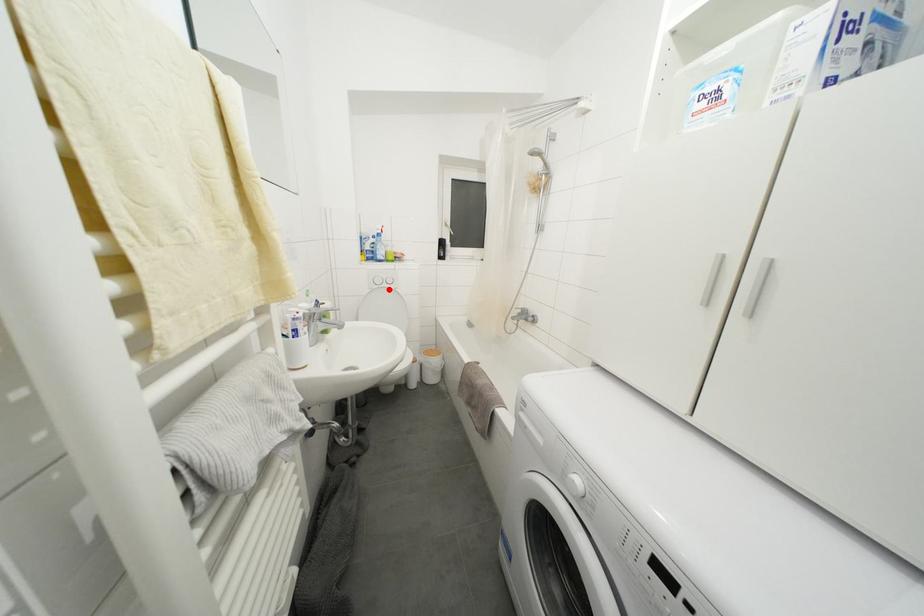
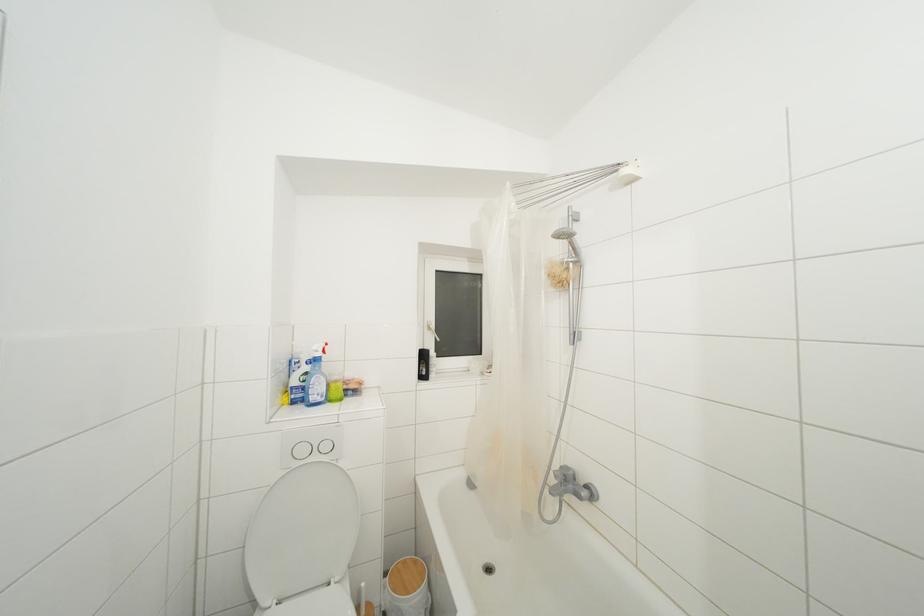
The point at the highlighted location is marked in the first image. Where is the corresponding point in the second image?

(320, 463)